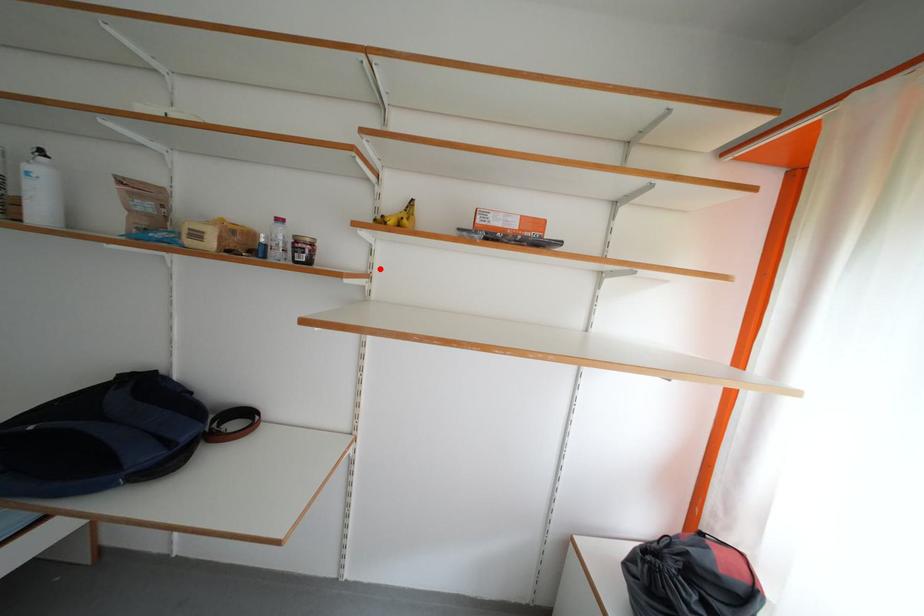
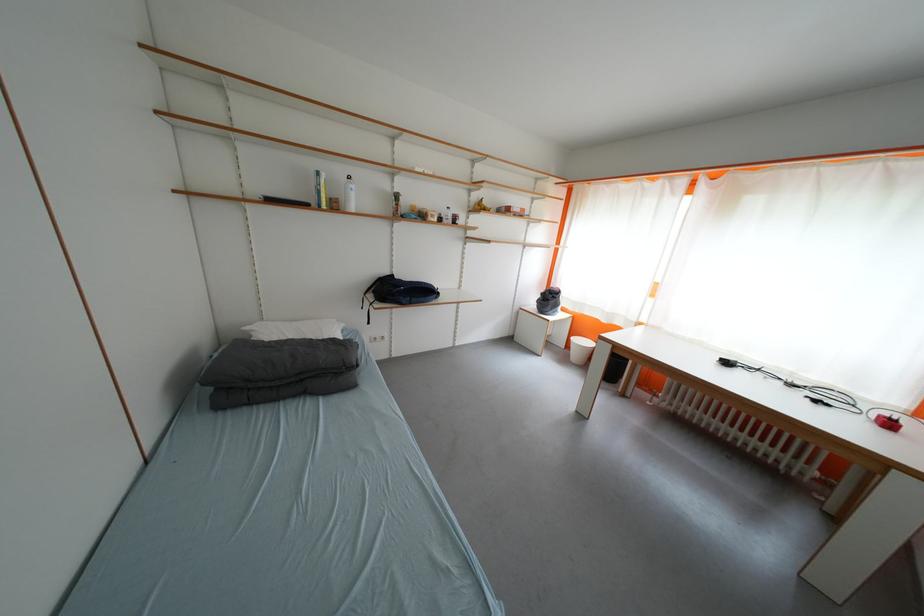
Question: I am providing you with two images of the same scene from different viewpoints. Given a red point in image1, look at the same physical point in image2. Is it:

Choices:
 (A) Closer to the viewpoint
 (B) Farther from the viewpoint

Answer: (A)